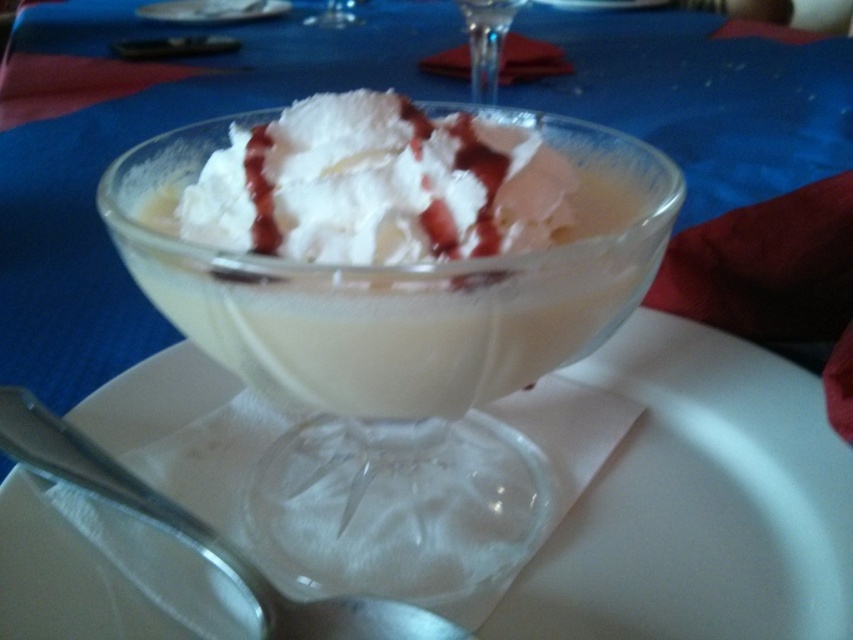
Question: Is silver metallic spoon at lower left bigger than transparent glass martini glass at center?

Choices:
 (A) yes
 (B) no

Answer: (A)

Question: Based on their relative distances, which object is nearer to the transparent glass martini glass at center?

Choices:
 (A) transparent glass at center
 (B) white paper plate at center

Answer: (A)

Question: Where is transparent glass at center located in relation to silver metallic spoon at lower left in the image?

Choices:
 (A) below
 (B) above

Answer: (B)

Question: Which point appears farthest from the camera in this image?

Choices:
 (A) (492, 90)
 (B) (202, 554)
 (C) (534, 275)

Answer: (A)

Question: Which point is closer to the camera?

Choices:
 (A) click(254, 582)
 (B) click(57, 616)

Answer: (A)

Question: From the image, what is the correct spatial relationship of white paper plate at center in relation to transparent glass at center?

Choices:
 (A) below
 (B) above

Answer: (A)